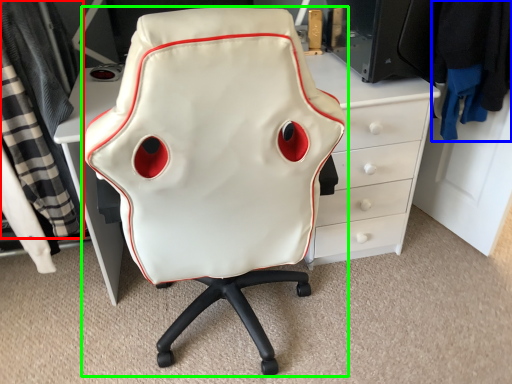
Question: Based on their relative distances, which object is farther from clothing (highlighted by a red box)? Choose from clothing (highlighted by a blue box) and chair (highlighted by a green box).

Choices:
 (A) clothing
 (B) chair

Answer: (A)